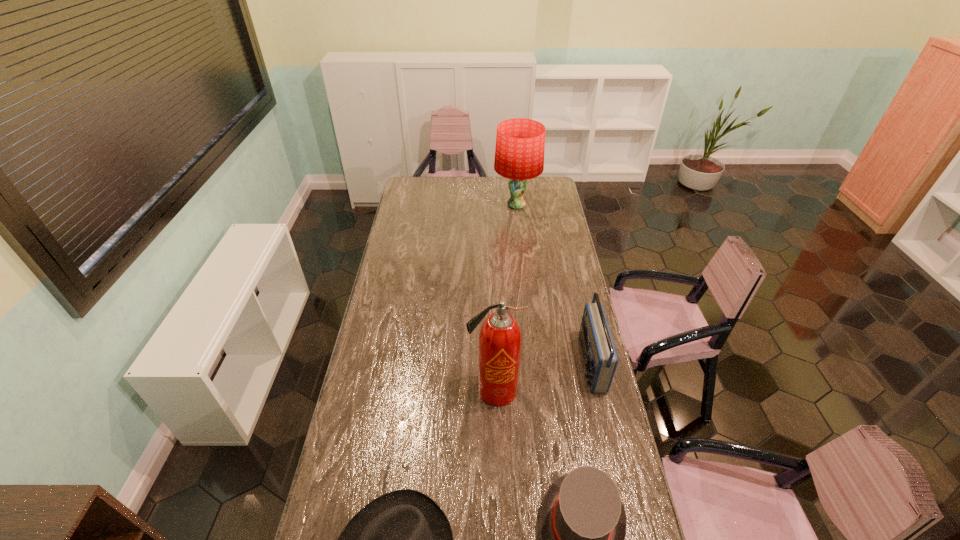
Image resolution: width=960 pixels, height=540 pixels. Identify the location of free area in between the third tallest object and the farthest object. (554, 284).

The height and width of the screenshot is (540, 960). Identify the location of blank region between the farthest object and the third shortest object. (554, 284).

You are a GUI agent. You are given a task and a screenshot of the screen. Output one action in this format:
    pyautogui.click(x=<x>, y=<y>)
    Task: Click on the free space between the third shortest object and the farthest object
    
    Given the screenshot: What is the action you would take?
    pyautogui.click(x=554, y=284)

Locate which object ranks fourth in proximity to the dress hat. Please provide its 2D coordinates. Your answer should be formatted as a tuple, i.e. [(x, y)], where the tuple contains the x and y coordinates of a point satisfying the conditions above.

[(520, 143)]

The image size is (960, 540). In order to click on object that stands as the second closest to the lampshade in this screenshot , I will do `click(499, 348)`.

Locate an element on the screen. free spot that satisfies the following two spatial constraints: 1. on the front panel of the third shortest object; 2. on the front side of the fire extinguisher is located at coordinates (597, 390).